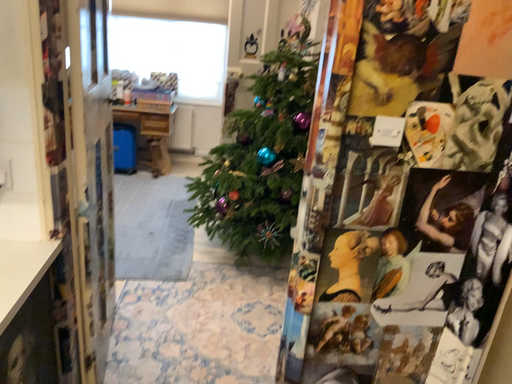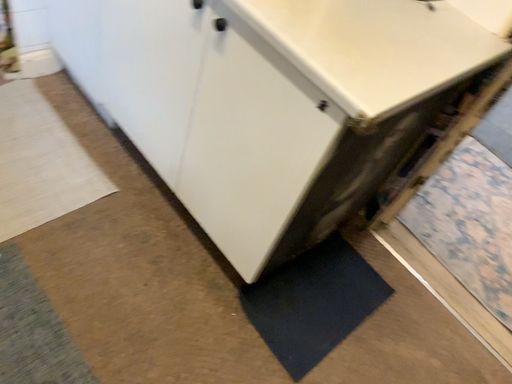
Question: How did the camera likely rotate when shooting the video?

Choices:
 (A) rotated right
 (B) rotated left

Answer: (B)